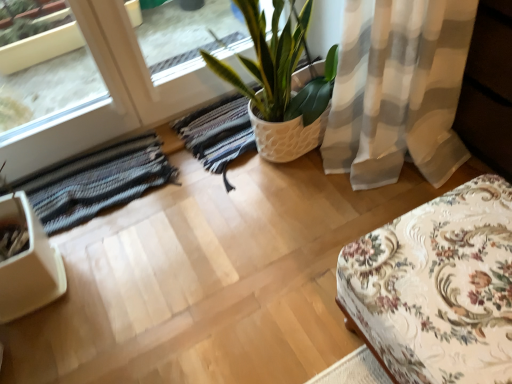
Question: Looking at their shapes, would you say striped woolen rug at lower left is wider or thinner than floral fabric ottoman at lower right?

Choices:
 (A) thin
 (B) wide

Answer: (A)

Question: Based on their sizes in the image, would you say striped woolen rug at lower left is bigger or smaller than floral fabric ottoman at lower right?

Choices:
 (A) small
 (B) big

Answer: (A)

Question: Which of these objects is positioned farthest from the floral fabric ottoman at lower right?

Choices:
 (A) striped woolen rug at lower left
 (B) white textured pot at center

Answer: (A)

Question: Considering the real-world distances, which object is farthest from the striped woolen rug at lower left?

Choices:
 (A) white textured pot at center
 (B) floral fabric ottoman at lower right

Answer: (B)